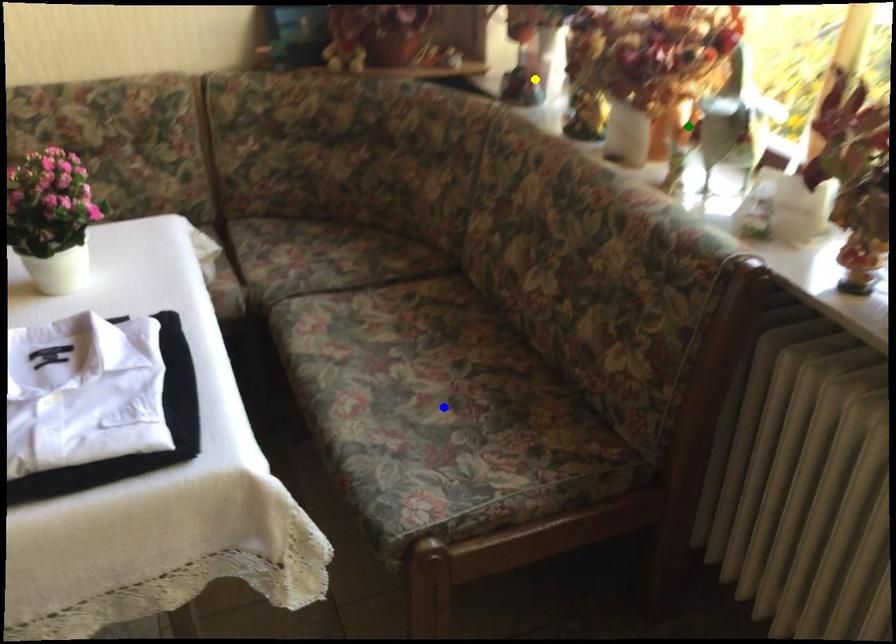
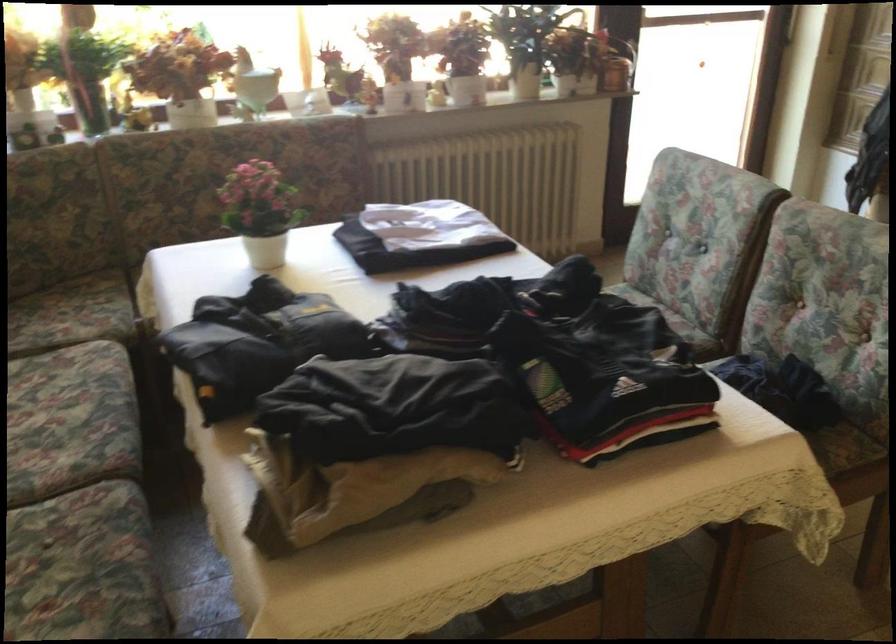
I am providing you with two images of the same scene from different viewpoints. Three points are marked in image1. Which point corresponds to a part or object that is occluded in image2?In image1, three points are marked. Which of them correspond to a part or object that is occluded in image2?Among the three points shown in image1, which one corresponds to a part or object that is no longer visible due to occlusion in image2?

blue point